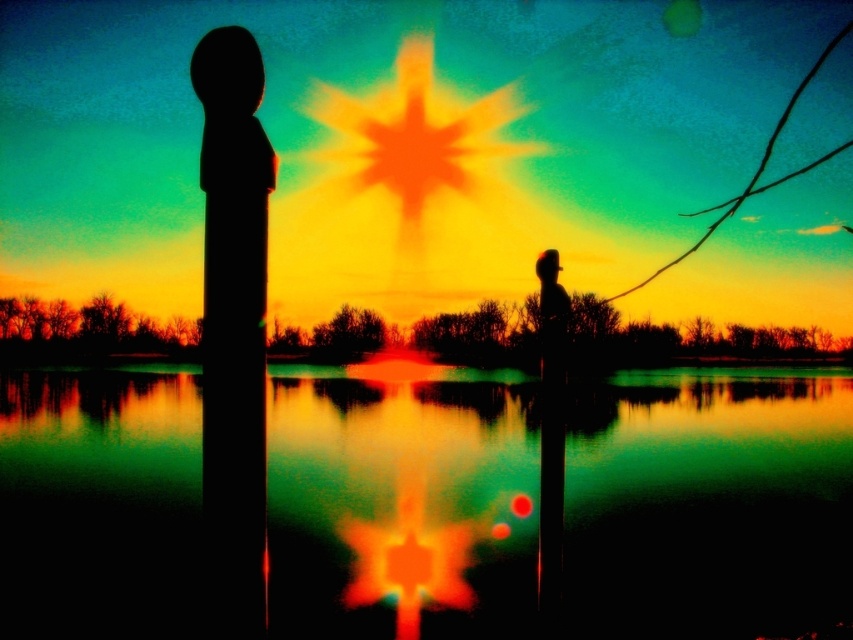
You are a photographer trying to capture the sunset reflection on the green reflective water at center. To ensure the reflection is centered in your photo, where should you aim your camera?

The green reflective water at center is located at the 2D coordinates point (706, 502), so aim your camera at that point to center the reflection.

You are standing on the dock and see the green reflective water at center and the black matte pillar at left. Which object is located to the right of the other?

The green reflective water at center is positioned on the right side of black matte pillar at left.

You are standing on the shore of the lake and want to place a 30 meter long boat between the green reflective water at center and the black matte pillar at left. Can the boat fit between them?

The distance between the green reflective water at center and the black matte pillar at left is 25.41 meters, which is shorter than the boat length of 30 meters. Therefore, the boat cannot fit between them.